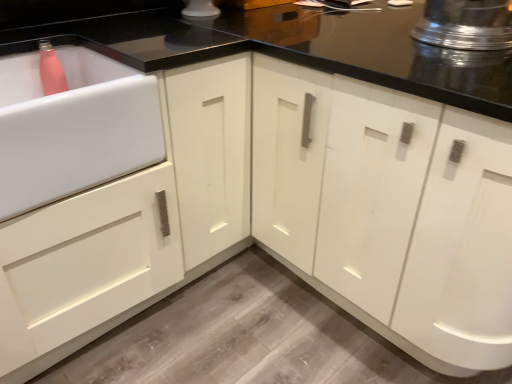
Question: Relative to white glossy cabinet at center, is shiny metallic pot at upper right in front or behind?

Choices:
 (A) behind
 (B) front

Answer: (A)

Question: Considering the positions of shiny metallic pot at upper right and white glossy cabinet at center in the image, is shiny metallic pot at upper right wider or thinner than white glossy cabinet at center?

Choices:
 (A) wide
 (B) thin

Answer: (B)

Question: Which of these objects is positioned closest to the shiny metallic pot at upper right?

Choices:
 (A) white glossy cabinet at center
 (B) white glossy sink at left

Answer: (A)

Question: Estimate the real-world distances between objects in this image. Which object is closer to the shiny metallic pot at upper right?

Choices:
 (A) white glossy sink at left
 (B) white glossy cabinet at center

Answer: (B)